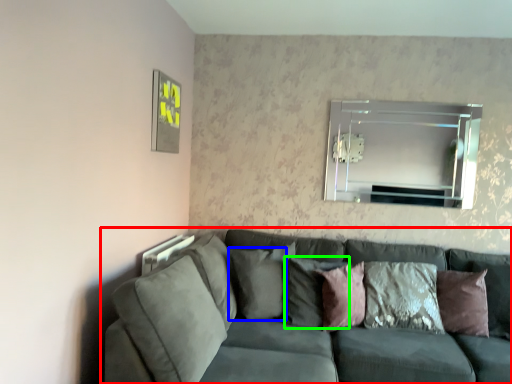
Question: Which object is positioned closest to studio couch (highlighted by a red box)? Select from pillow (highlighted by a blue box) and pillow (highlighted by a green box).

Choices:
 (A) pillow
 (B) pillow

Answer: (A)